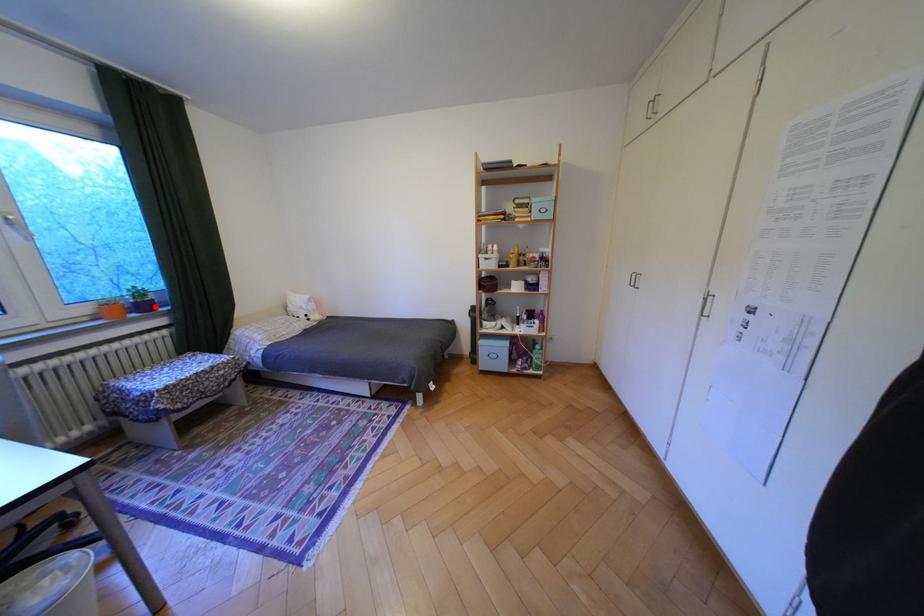
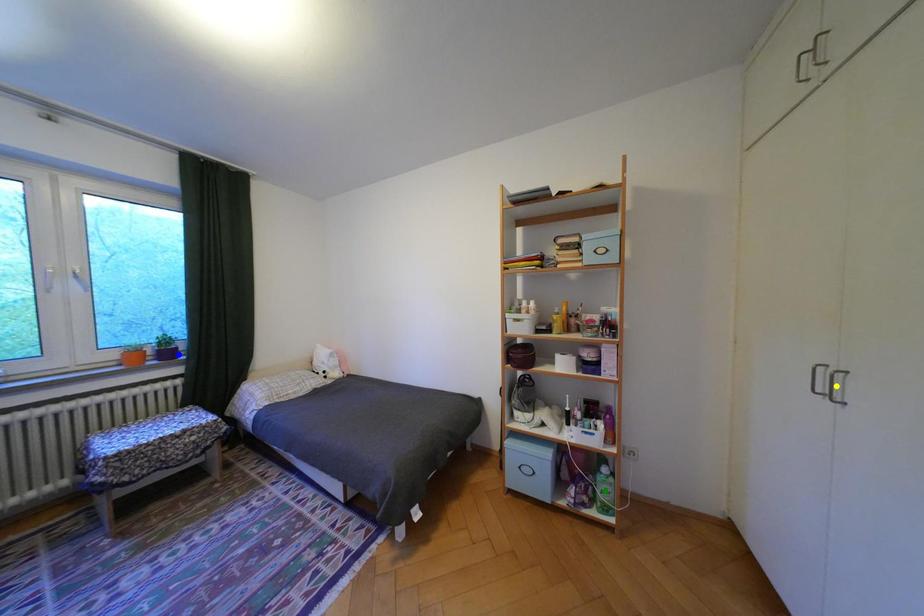
Question: I am providing you with two images of the same scene from different viewpoints. A red point is marked on the first image. You are given multiple points on the second image. Which point in image 2 represents the same 3d spot as the red point in image 1?

Choices:
 (A) yellow point
 (B) green point
 (C) blue point

Answer: (C)